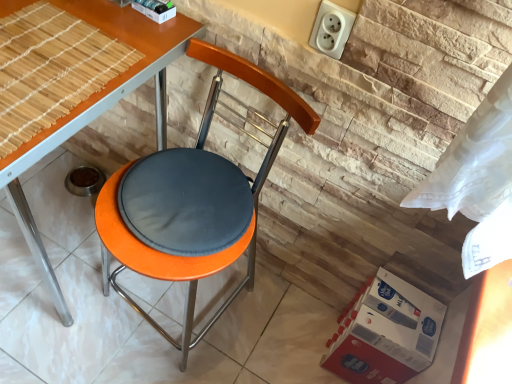
This screenshot has width=512, height=384. Find the location of `free point below orange fabric-covered chair at center (from a real-world perspective)`. free point below orange fabric-covered chair at center (from a real-world perspective) is located at coordinates point(179,309).